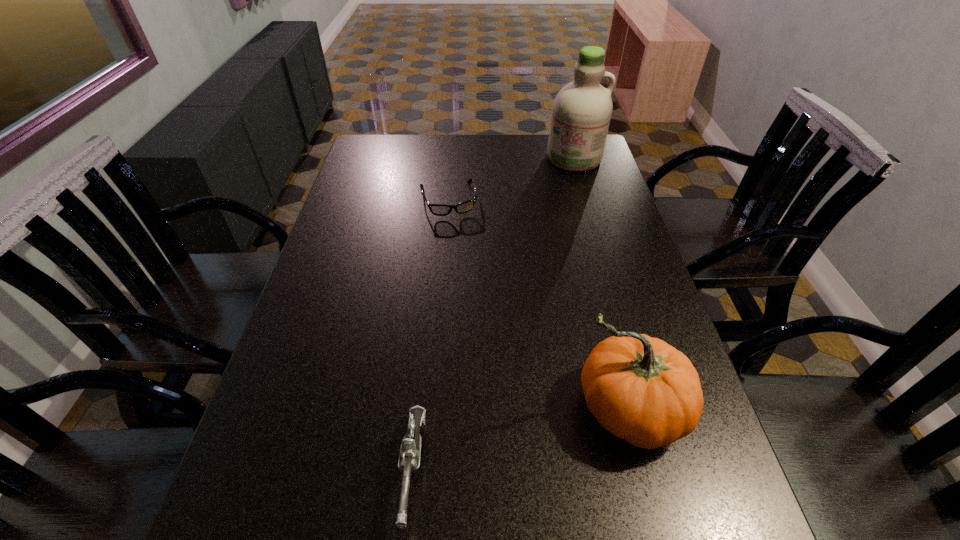
Where is `free spot on the desktop that is between the second shortest object and the third shortest object and is positioned on the front label of the tallest object`? This screenshot has height=540, width=960. free spot on the desktop that is between the second shortest object and the third shortest object and is positioned on the front label of the tallest object is located at coordinates (516, 440).

Identify the location of free space on the desktop that is between the second shortest object and the pumpkin and is positioned on the front-facing side of the spectacles. The height and width of the screenshot is (540, 960). (508, 442).